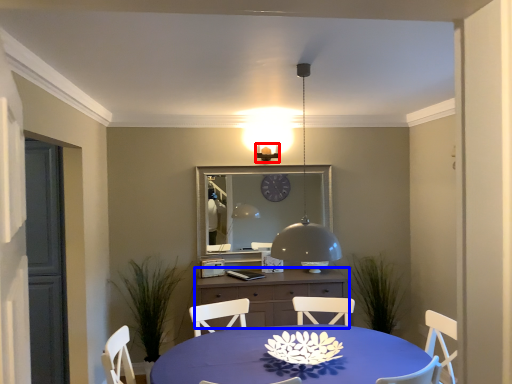
Question: Which object is further to the camera taking this photo, light fixture (highlighted by a red box) or cabinetry (highlighted by a blue box)?

Choices:
 (A) light fixture
 (B) cabinetry

Answer: (A)